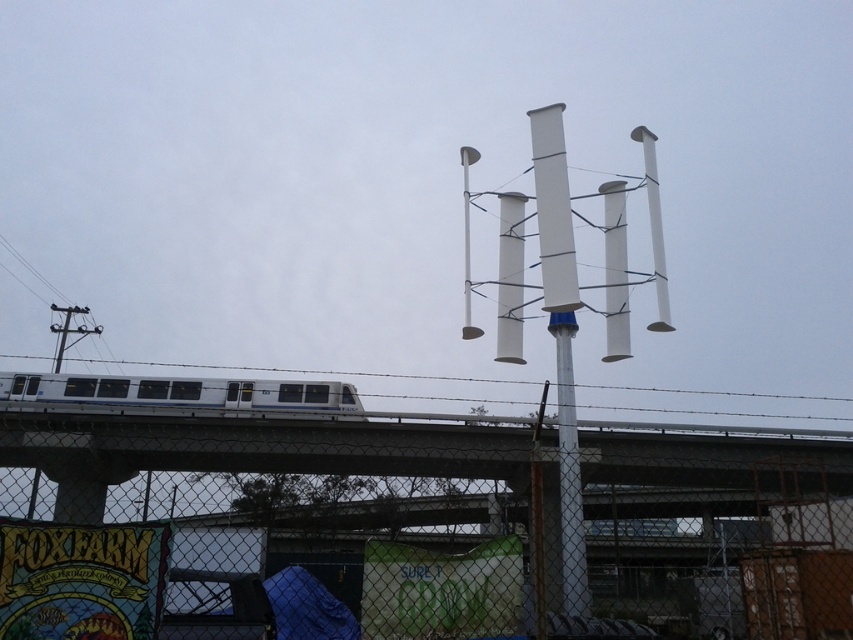
Describe the element at coordinates (248, 449) in the screenshot. I see `metal chain-link fence at lower center` at that location.

Describe the element at coordinates (248, 449) in the screenshot. I see `metal chain-link fence at lower center` at that location.

Image resolution: width=853 pixels, height=640 pixels. Identify the location of metal chain-link fence at lower center. (248, 449).